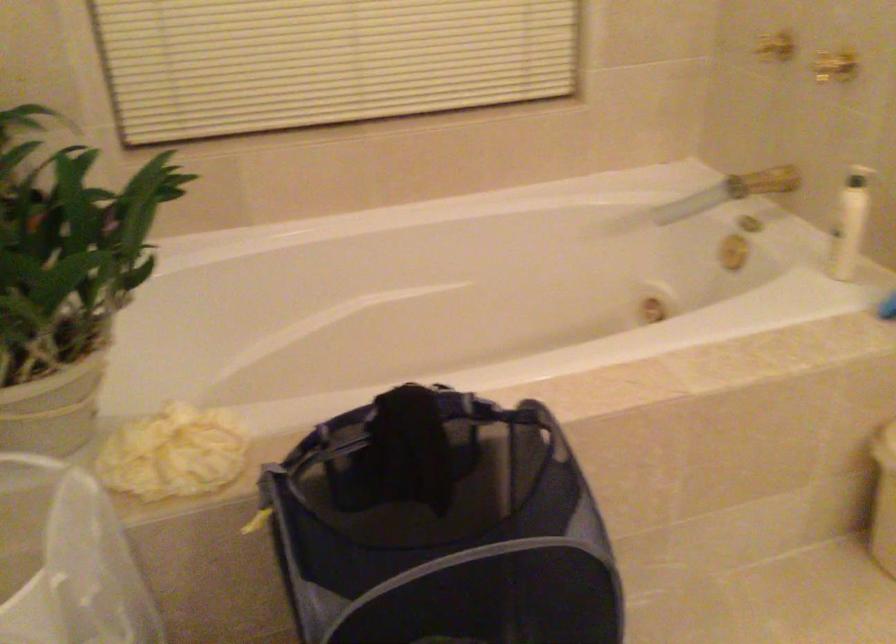
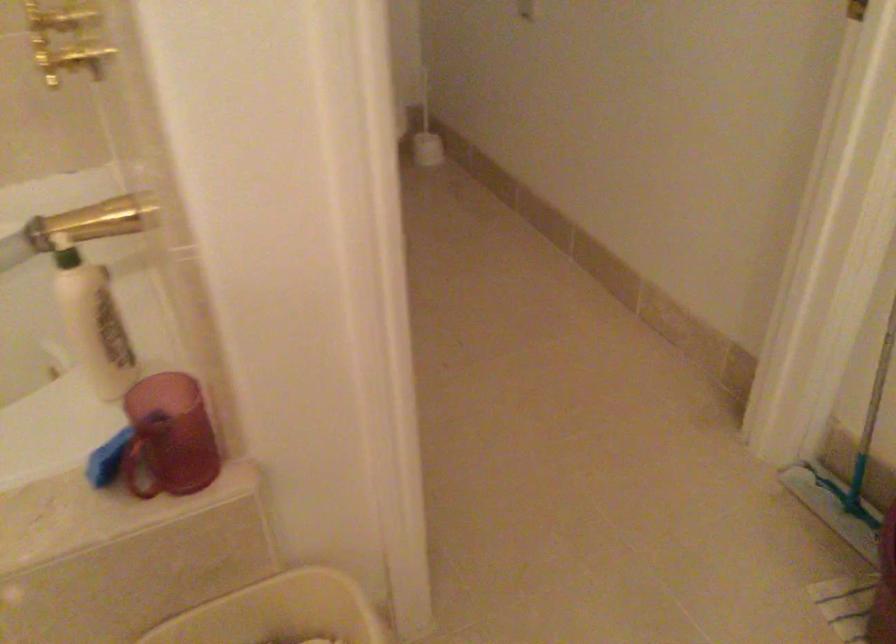
In a continuous first-person perspective shot, in which direction is the camera moving?

The movement direction of the cameraman is right, forward.